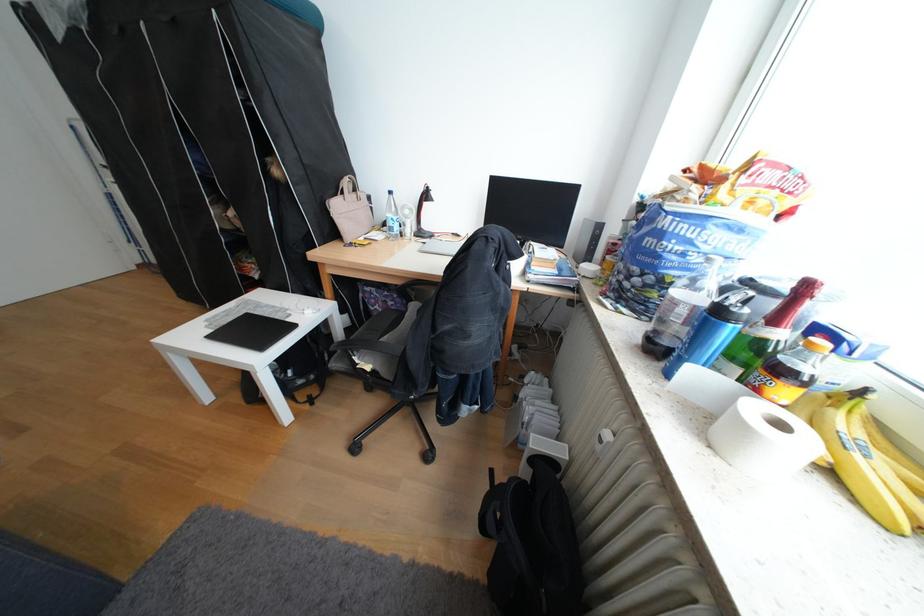
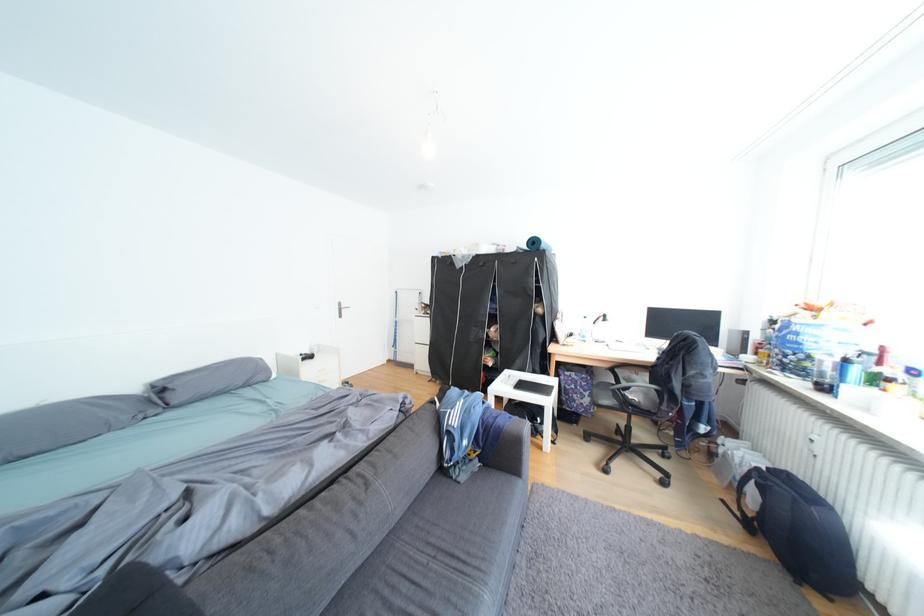
Find the pixel in the second image that matches [355,193] in the first image.

(570, 318)